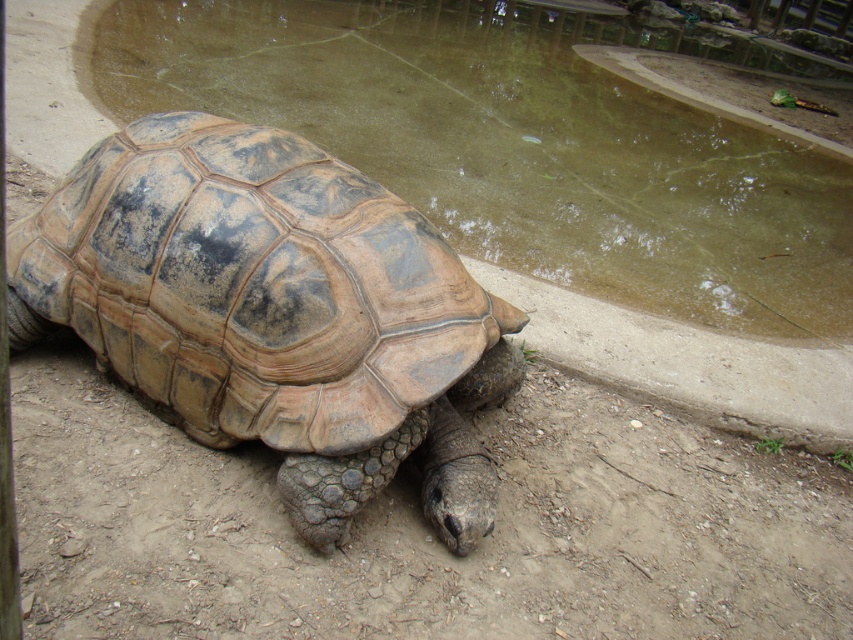
Between brown textured concrete at lower left and brown textured shell at center, which one appears on the right side from the viewer's perspective?

brown textured concrete at lower left is more to the right.

Measure the distance between brown textured concrete at lower left and camera.

3.50 meters

The image size is (853, 640). What are the coordinates of `brown textured concrete at lower left` in the screenshot? It's located at (519, 144).